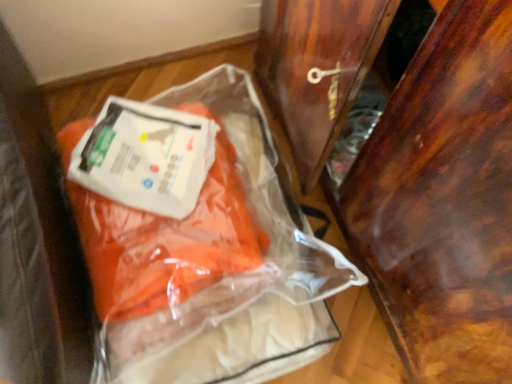
Question: Is wooden wardrobe door at right situated inside transparent plastic bag at center or outside?

Choices:
 (A) outside
 (B) inside

Answer: (A)

Question: From the image's perspective, is wooden wardrobe door at right positioned above or below transparent plastic bag at center?

Choices:
 (A) below
 (B) above

Answer: (B)

Question: In the image, is wooden wardrobe door at right positioned in front of or behind transparent plastic bag at center?

Choices:
 (A) behind
 (B) front

Answer: (B)

Question: From a real-world perspective, is transparent plastic bag at center positioned above or below wooden wardrobe door at right?

Choices:
 (A) below
 (B) above

Answer: (A)

Question: Is point (196, 321) positioned closer to the camera than point (467, 334)?

Choices:
 (A) closer
 (B) farther

Answer: (B)

Question: Is transparent plastic bag at center in front of or behind wooden wardrobe door at right in the image?

Choices:
 (A) behind
 (B) front

Answer: (A)

Question: Looking at the image, does transparent plastic bag at center seem bigger or smaller compared to wooden wardrobe door at right?

Choices:
 (A) big
 (B) small

Answer: (B)